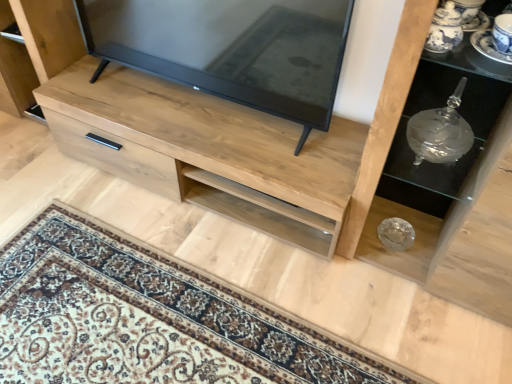
At what (x,y) coordinates should I click in order to perform the action: click on empty space that is ontop of natural wood chest of drawers at center (from a real-world perspective). Please return your answer as a coordinate pair (x, y). The width and height of the screenshot is (512, 384). Looking at the image, I should click on (198, 117).